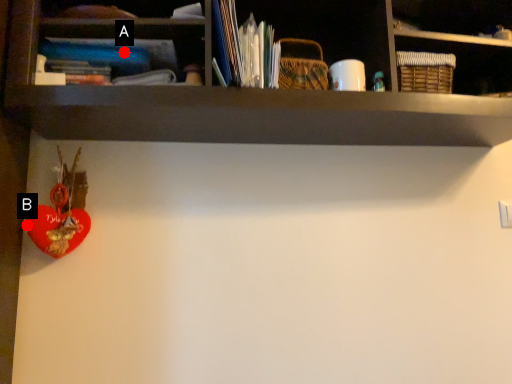
Question: Two points are circled on the image, labeled by A and B beside each circle. Which point appears farthest from the camera in this image?

Choices:
 (A) A is further
 (B) B is further

Answer: (B)